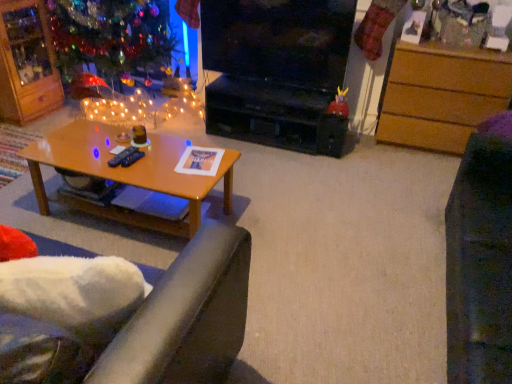
Identify the location of vacant area that lies to the right of black plastic remote control at center, the 2th remote control viewed from the left. (159, 160).